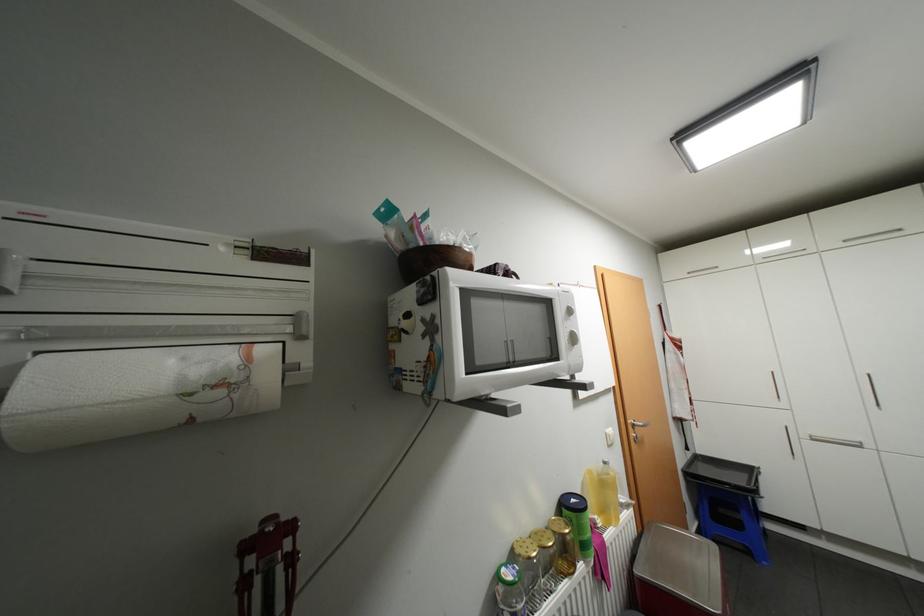
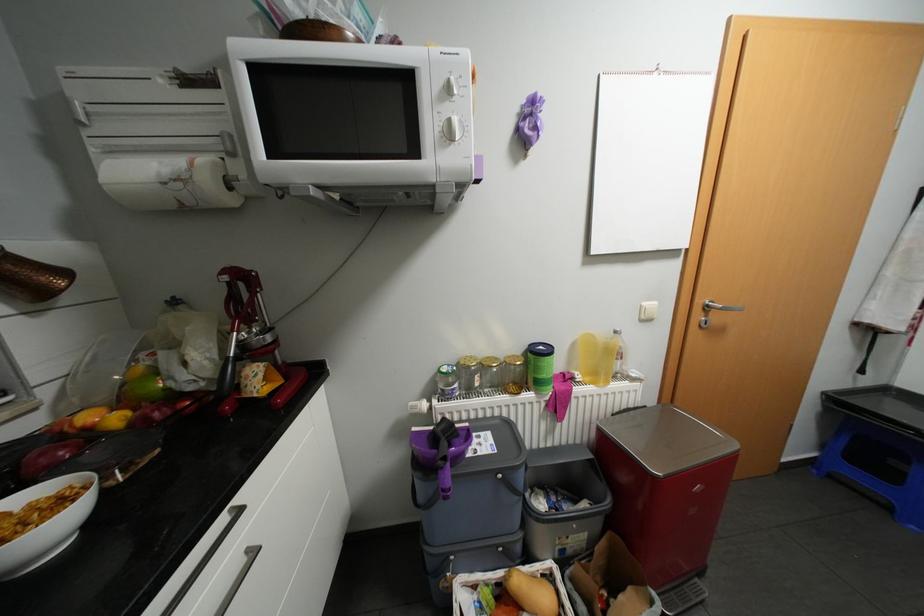
Find the pixel in the second image that matches point 616,445 in the first image.

(649, 320)